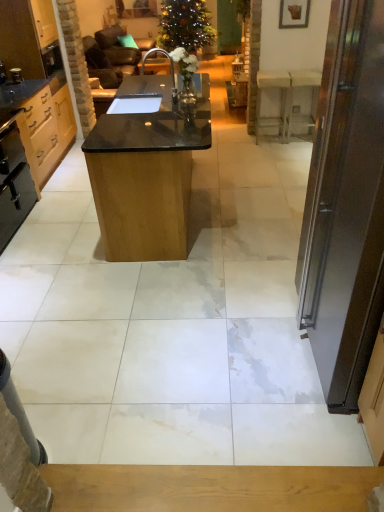
Question: Is the position of dark brown wooden door at right less distant than that of white marble table at right, which ranks as the 1th table in back-to-front order?

Choices:
 (A) yes
 (B) no

Answer: (A)

Question: Is dark brown wooden door at right at the right side of white marble table at right, which ranks as the 2th table in left-to-right order?

Choices:
 (A) yes
 (B) no

Answer: (B)

Question: Is dark brown wooden door at right positioned far away from white marble table at right, which ranks as the 1th table in back-to-front order?

Choices:
 (A) yes
 (B) no

Answer: (A)

Question: From a real-world perspective, is dark brown wooden door at right physically below white marble table at right, which ranks as the 2th table in left-to-right order?

Choices:
 (A) yes
 (B) no

Answer: (B)

Question: From a real-world perspective, is dark brown wooden door at right physically above white marble table at right, which is the 2th table in front-to-back order?

Choices:
 (A) yes
 (B) no

Answer: (A)

Question: Can you confirm if dark brown wooden door at right is wider than white marble table at right, which ranks as the 2th table in left-to-right order?

Choices:
 (A) yes
 (B) no

Answer: (A)

Question: From a real-world perspective, is matte wood cabinet at left, acting as the second cabinetry starting from the top, physically above black polished wood table at center, the second table viewed from the right?

Choices:
 (A) yes
 (B) no

Answer: (A)

Question: Considering the relative sizes of matte wood cabinet at left, the 1th cabinetry in the bottom-to-top sequence, and black polished wood table at center, the second table viewed from the right, in the image provided, is matte wood cabinet at left, the 1th cabinetry in the bottom-to-top sequence, smaller than black polished wood table at center, the second table viewed from the right,?

Choices:
 (A) yes
 (B) no

Answer: (A)

Question: Considering the relative sizes of matte wood cabinet at left, the 1th cabinetry in the bottom-to-top sequence, and black polished wood table at center, which is counted as the 2th table, starting from the back, in the image provided, is matte wood cabinet at left, the 1th cabinetry in the bottom-to-top sequence, bigger than black polished wood table at center, which is counted as the 2th table, starting from the back,?

Choices:
 (A) no
 (B) yes

Answer: (A)

Question: Considering the relative sizes of matte wood cabinet at left, the 1th cabinetry in the bottom-to-top sequence, and black polished wood table at center, which is counted as the 2th table, starting from the back, in the image provided, is matte wood cabinet at left, the 1th cabinetry in the bottom-to-top sequence, taller than black polished wood table at center, which is counted as the 2th table, starting from the back,?

Choices:
 (A) yes
 (B) no

Answer: (B)

Question: Is matte wood cabinet at left, the 1th cabinetry in the bottom-to-top sequence, further to the viewer compared to black polished wood table at center, which is counted as the 2th table, starting from the back?

Choices:
 (A) yes
 (B) no

Answer: (A)

Question: Can you confirm if matte wood cabinet at left, acting as the second cabinetry starting from the top, is wider than black polished wood table at center, the second table viewed from the right?

Choices:
 (A) yes
 (B) no

Answer: (B)

Question: Does light wood cabinet at left, which is the first cabinetry from top to bottom, appear on the right side of white marble table at right, which ranks as the 2th table in left-to-right order?

Choices:
 (A) yes
 (B) no

Answer: (B)